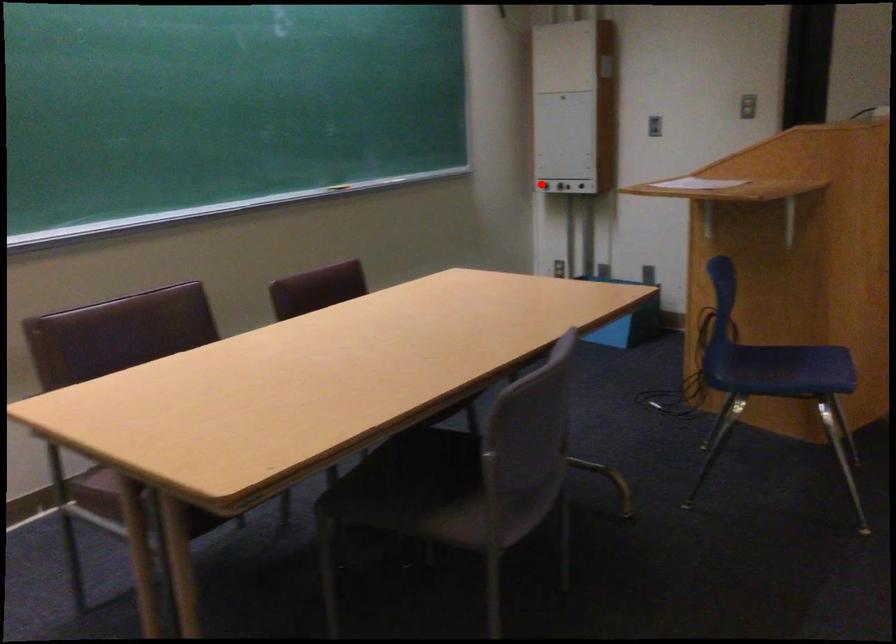
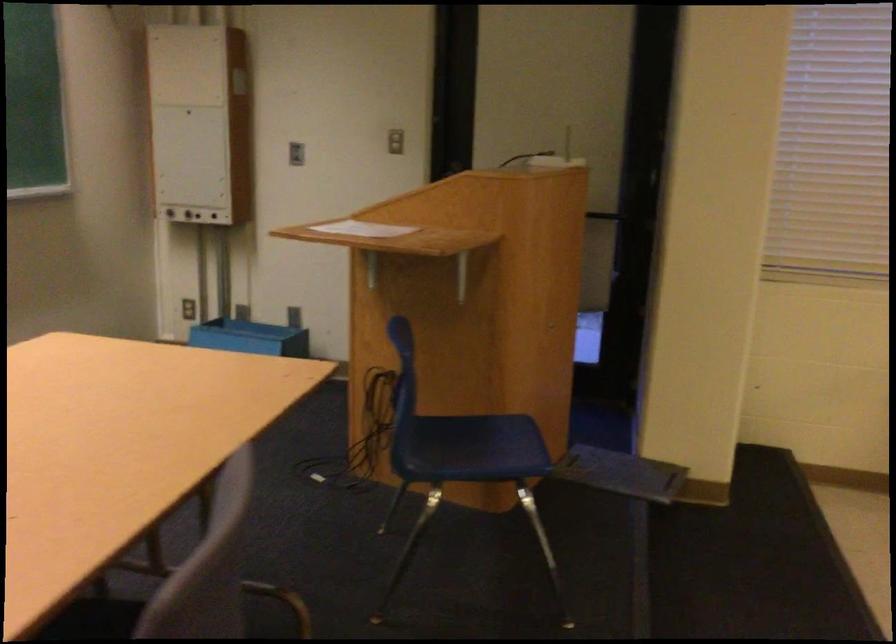
Find the pixel in the second image that matches the highlighted location in the first image.

(167, 210)